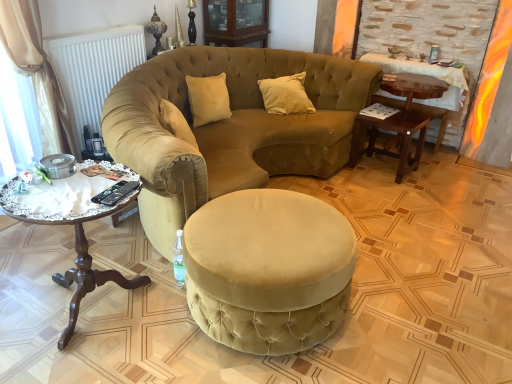
Where is `free location above wooden side table at right (from a real-world perspective)`? free location above wooden side table at right (from a real-world perspective) is located at coordinates (391, 111).